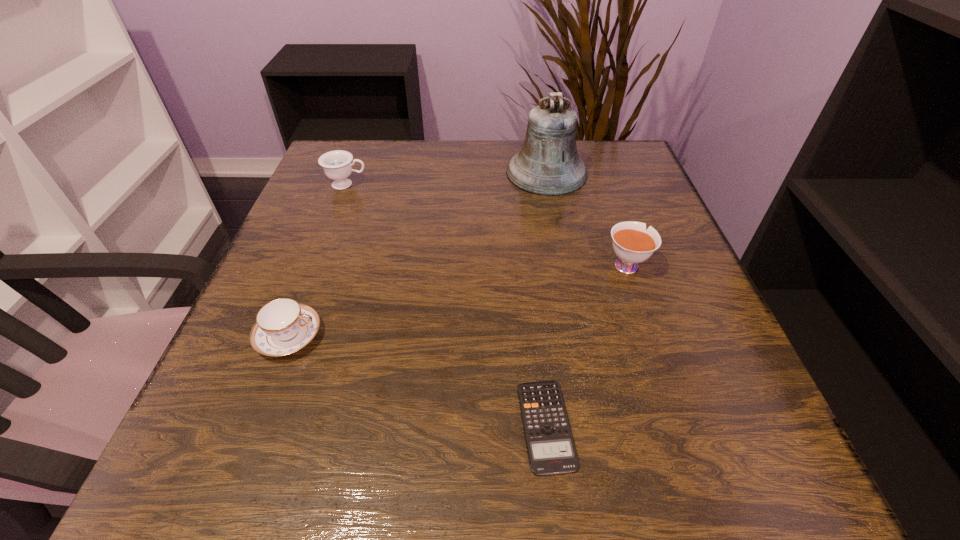
You are a GUI agent. You are given a task and a screenshot of the screen. Output one action in this format:
    pyautogui.click(x=<x>, y=<y>)
    Task: Click on the free space between the farthest teacup and the fourth tallest object
    Image resolution: width=960 pixels, height=540 pixels.
    Given the screenshot: What is the action you would take?
    pyautogui.click(x=318, y=260)

In order to click on empty location between the fourth farthest object and the third nearest object in this screenshot , I will do `click(457, 300)`.

The height and width of the screenshot is (540, 960). What are the coordinates of `free area in between the farthest teacup and the shortest object` in the screenshot? It's located at (446, 305).

Where is `empty space between the second shortest object and the rightmost teacup`? This screenshot has height=540, width=960. empty space between the second shortest object and the rightmost teacup is located at coordinates (457, 300).

Find the location of a particular element. The width and height of the screenshot is (960, 540). unoccupied area between the bell and the shortest object is located at coordinates (546, 299).

Where is `object that is the nearest to the farthest teacup`? object that is the nearest to the farthest teacup is located at coordinates (548, 164).

Point out which object is positioned as the nearest to the fourth farthest object. Please provide its 2D coordinates. Your answer should be formatted as a tuple, i.e. [(x, y)], where the tuple contains the x and y coordinates of a point satisfying the conditions above.

[(551, 449)]

I want to click on the closest teacup relative to the farthest teacup, so click(283, 326).

Identify the location of teacup object that ranks as the second closest to the calculator. (283, 326).

Find the location of `vacant point that satisfies the following two spatial constraints: 1. on the side with the handle of the calculator; 2. on the right side of the shortest teacup`. vacant point that satisfies the following two spatial constraints: 1. on the side with the handle of the calculator; 2. on the right side of the shortest teacup is located at coordinates (254, 426).